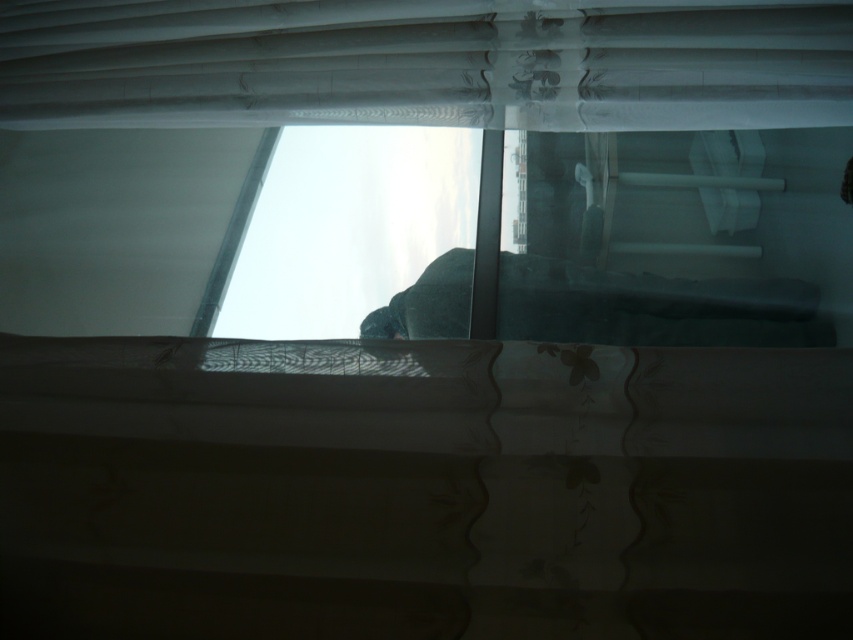
Is transparent glass window at center bigger than sheer white curtain at upper center?

Correct, transparent glass window at center is larger in size than sheer white curtain at upper center.

The image size is (853, 640). Find the location of `transparent glass window at center`. transparent glass window at center is located at coordinates (677, 237).